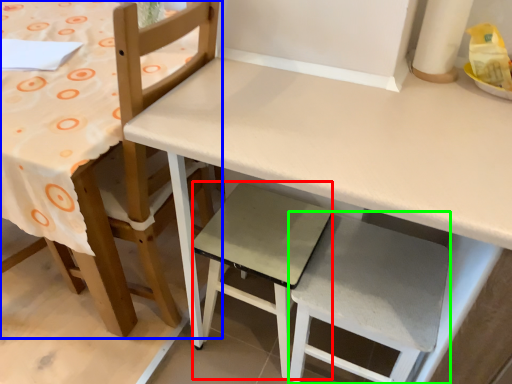
Question: Which object is the closest to the step stool (highlighted by a red box)? Choose among these: chair (highlighted by a blue box) or step stool (highlighted by a green box).

Choices:
 (A) chair
 (B) step stool

Answer: (B)